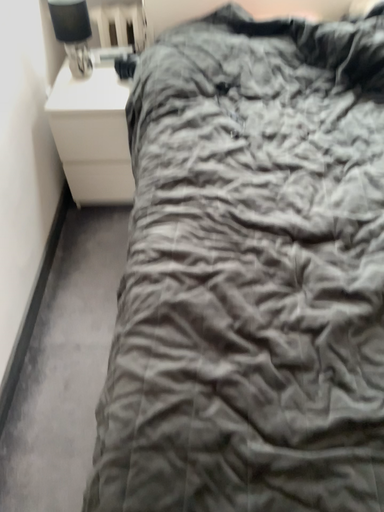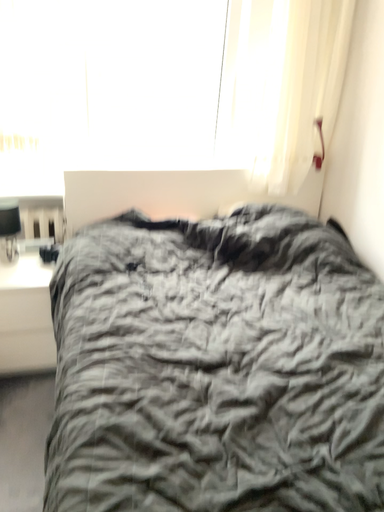
Question: How did the camera likely rotate when shooting the video?

Choices:
 (A) rotated downward
 (B) rotated upward

Answer: (B)